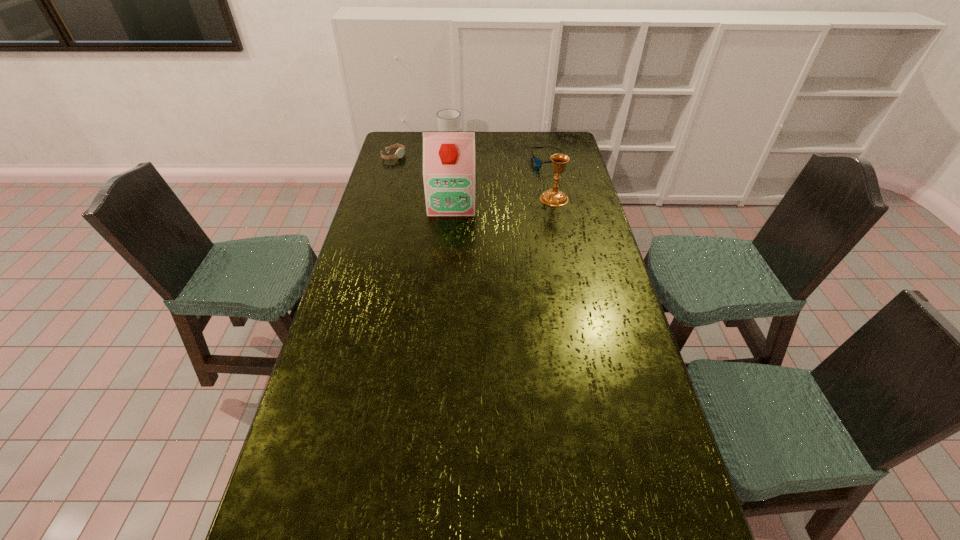
Locate an element on the screen. The image size is (960, 540). blank region between the third shortest object and the sunglasses is located at coordinates (499, 153).

Where is `vacant area between the shortest object and the third shortest object`? The image size is (960, 540). vacant area between the shortest object and the third shortest object is located at coordinates (499, 153).

You are a GUI agent. You are given a task and a screenshot of the screen. Output one action in this format:
    pyautogui.click(x=<x>, y=<y>)
    Task: Click on the empty space that is in between the third shortest object and the sunglasses
    The image size is (960, 540).
    Given the screenshot: What is the action you would take?
    pyautogui.click(x=499, y=153)

At what (x,y) coordinates should I click in order to perform the action: click on free spot between the watch and the soya milk. Please return your answer as a coordinate pair (x, y). The width and height of the screenshot is (960, 540). Looking at the image, I should click on (423, 179).

The image size is (960, 540). In order to click on blank region between the sunglasses and the third tallest object in this screenshot , I will do `click(499, 153)`.

You are a GUI agent. You are given a task and a screenshot of the screen. Output one action in this format:
    pyautogui.click(x=<x>, y=<y>)
    Task: Click on the free spot between the leftmost object and the tallest object
    
    Given the screenshot: What is the action you would take?
    pyautogui.click(x=423, y=179)

Identify the location of free space between the chalice and the cup. The width and height of the screenshot is (960, 540). (502, 171).

At what (x,y) coordinates should I click in order to perform the action: click on free point between the third tallest object and the second tallest object. Please return your answer as a coordinate pair (x, y). Image resolution: width=960 pixels, height=540 pixels. Looking at the image, I should click on (502, 171).

Where is `the second closest object to the shortest object`? The image size is (960, 540). the second closest object to the shortest object is located at coordinates (448, 156).

This screenshot has width=960, height=540. What are the coordinates of `object that stands as the fourth closest to the tallest object` in the screenshot? It's located at (448, 119).